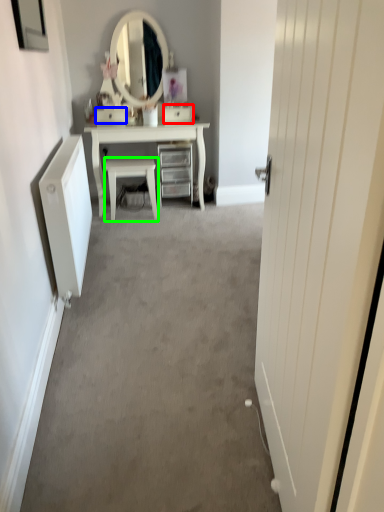
Question: Estimate the real-world distances between objects in this image. Which object is farther from drawer (highlighted by a red box), drawer (highlighted by a blue box) or chair (highlighted by a green box)?

Choices:
 (A) drawer
 (B) chair

Answer: (B)